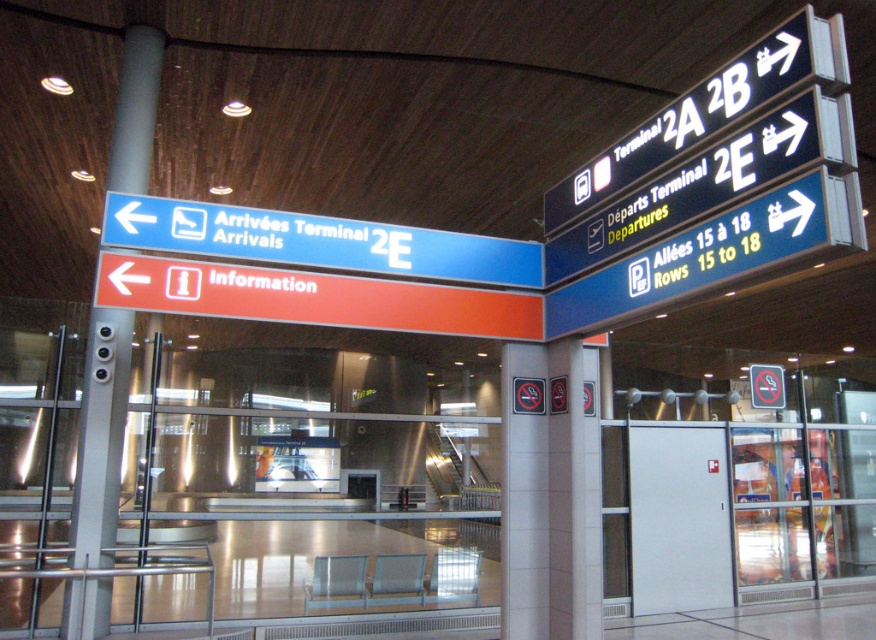
You are at an airport terminal and need to find the arrivals area. You see a blue plastic sign at left and a black plastic sign at upper right. According to the signs, which direction should you go?

The blue plastic sign at left points left towards Arrivailles Terminal 2E, so you should go left.

You are at the airport and need to locate the arrivals area. You see a gray metallic pole at left and a black plastic sign at upper right. Which object is taller?

The gray metallic pole at left is taller than the black plastic sign at upper right according to the description.

From the picture: You are at an airport terminal and need to locate the arrivals area. You see a blue plastic sign at left and a gray metallic pole at left. Which object is physically nearer to you?

The blue plastic sign at left is closer to the viewer than the gray metallic pole at left, so the blue plastic sign at left is physically nearer to you.